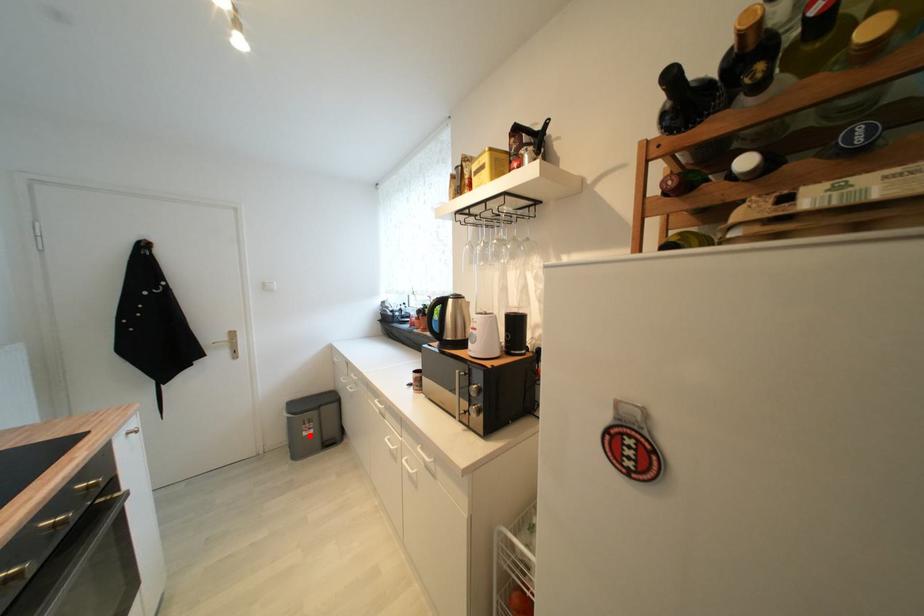
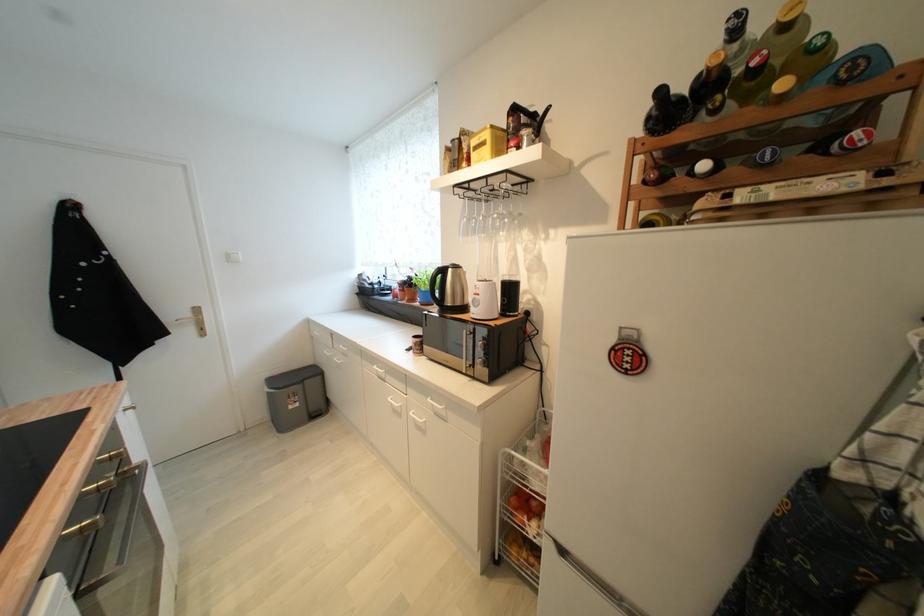
Question: I am providing you with two images of the same scene from different viewpoints. Image1 has a red point marked. In image2, the corresponding 3D location appears at what relative position? Reply with the corresponding letter.

Choices:
 (A) Closer
 (B) Farther

Answer: (A)